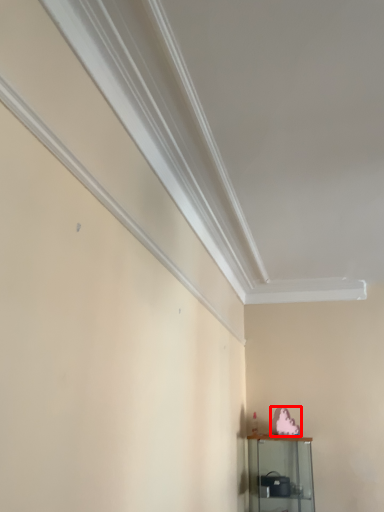
Question: Observing the image, what is the correct spatial positioning of animal (annotated by the red box) in reference to shelf?

Choices:
 (A) right
 (B) left

Answer: (A)